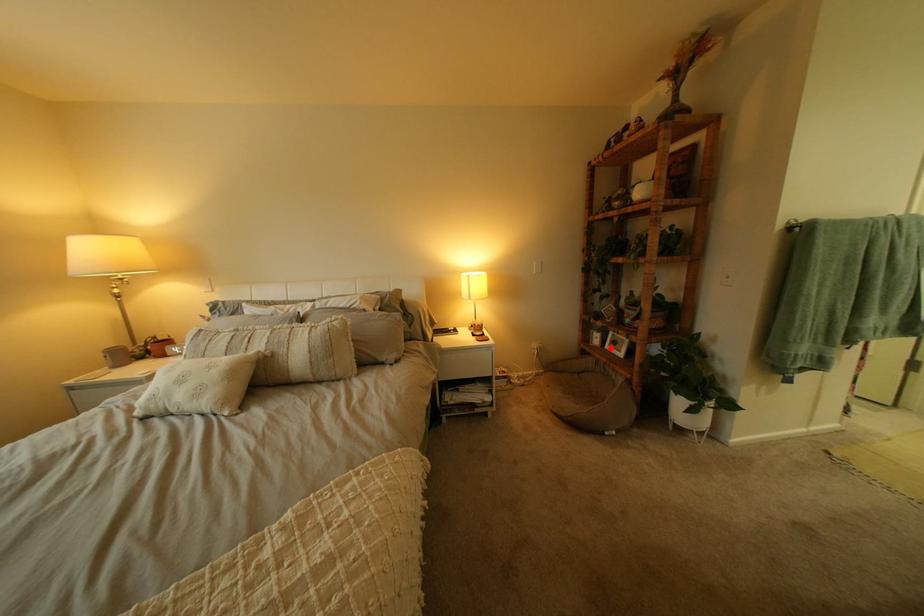
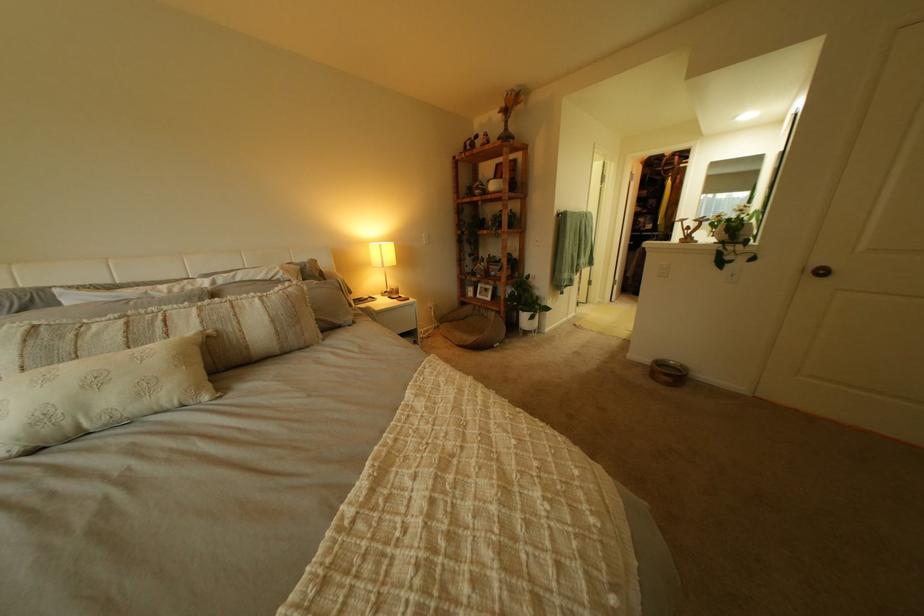
Question: I am providing you with two images of the same scene from different viewpoints. Given a red point in image1, look at the same physical point in image2. Is it:

Choices:
 (A) Closer to the viewpoint
 (B) Farther from the viewpoint

Answer: (A)